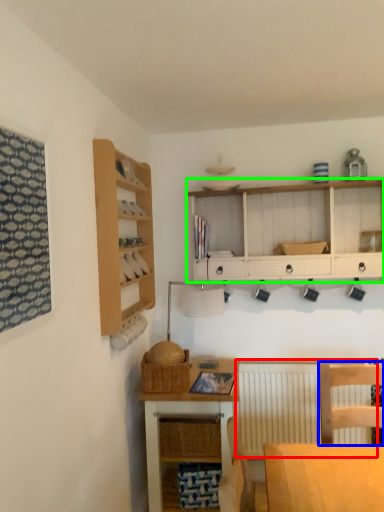
Question: Considering the real-world distances, which object is farthest from radiator (highlighted by a red box)? chair (highlighted by a blue box) or cabinetry (highlighted by a green box)?

Choices:
 (A) chair
 (B) cabinetry

Answer: (B)